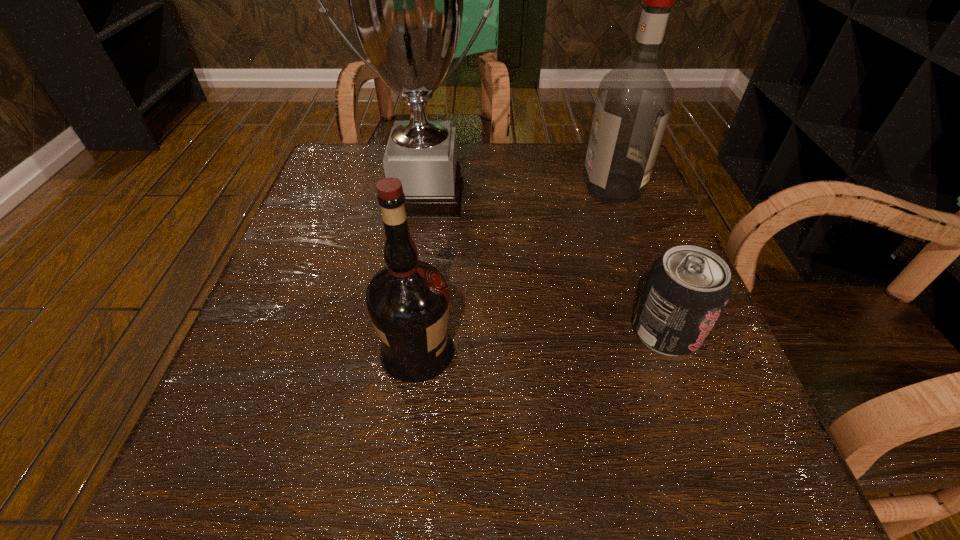
Where is `vacant region located 0.130m on the surface of the left liquor`? This screenshot has height=540, width=960. vacant region located 0.130m on the surface of the left liquor is located at coordinates (540, 352).

This screenshot has height=540, width=960. I want to click on free region located 0.120m on the front of the shortest object, so click(705, 438).

Locate an element on the screen. The height and width of the screenshot is (540, 960). trophy cup situated at the far edge is located at coordinates (x=405, y=0).

Find the location of a particular element. Image resolution: width=960 pixels, height=540 pixels. liquor that is at the far edge is located at coordinates (634, 101).

Locate an element on the screen. The height and width of the screenshot is (540, 960). object located in the left edge section of the desktop is located at coordinates (405, 0).

This screenshot has height=540, width=960. What are the coordinates of `liquor that is at the right edge` in the screenshot? It's located at (634, 101).

Identify the location of soda can positioned at the right edge. (686, 290).

The image size is (960, 540). What are the coordinates of `object that is at the far left corner` in the screenshot? It's located at (405, 0).

At what (x,y) coordinates should I click in order to perform the action: click on object present at the far right corner. Please return your answer as a coordinate pair (x, y). Looking at the image, I should click on (634, 101).

At what (x,y) coordinates should I click in order to perform the action: click on vacant position at the far edge of the desktop. Please return your answer as a coordinate pair (x, y). The height and width of the screenshot is (540, 960). Looking at the image, I should click on (530, 178).